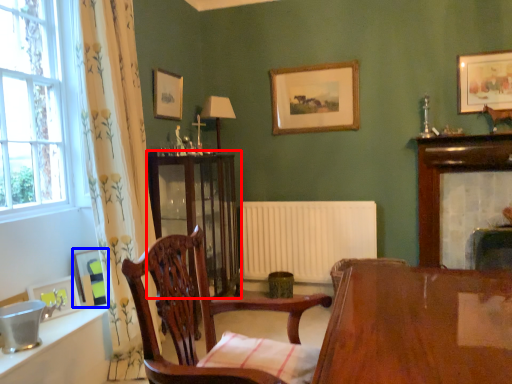
Question: Among these objects, which one is farthest to the camera, cabinetry (highlighted by a red box) or picture frame (highlighted by a blue box)?

Choices:
 (A) cabinetry
 (B) picture frame

Answer: (A)